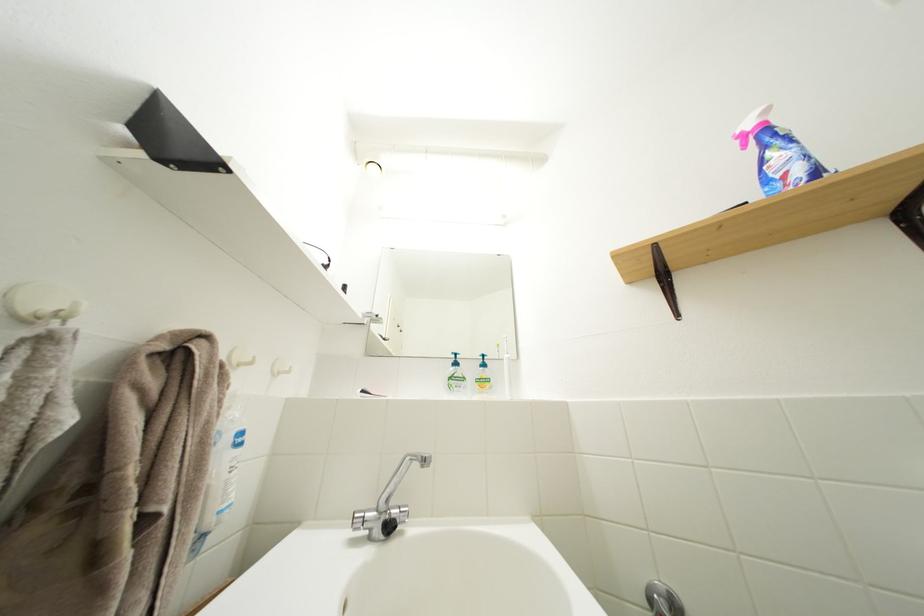
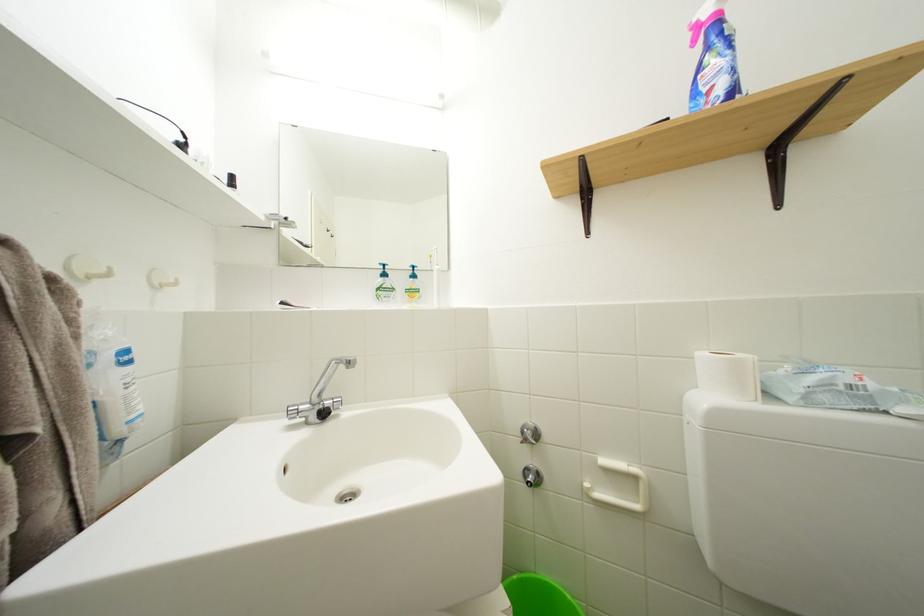
Question: Which direction would the cameraman need to move to produce the second image? Reply with the corresponding letter.

Choices:
 (A) Left
 (B) Right
 (C) Forward
 (D) Backward

Answer: (B)